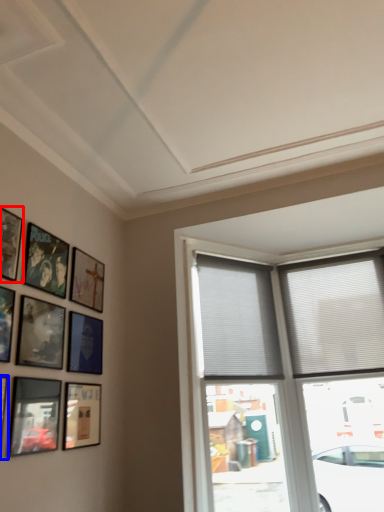
Question: Which object is further to the camera taking this photo, picture frame (highlighted by a red box) or picture frame (highlighted by a blue box)?

Choices:
 (A) picture frame
 (B) picture frame

Answer: (A)